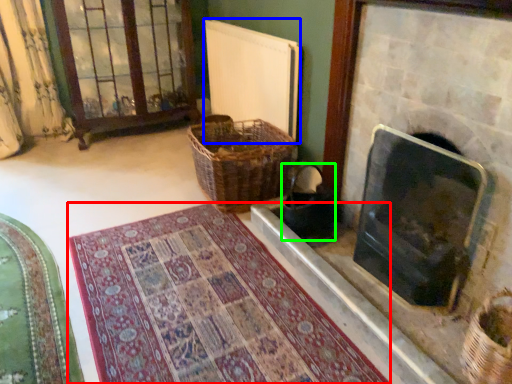
Question: Which object is positioned farthest from mat (highlighted by a red box)? Select from radiator (highlighted by a blue box) and laundry basket (highlighted by a green box).

Choices:
 (A) radiator
 (B) laundry basket

Answer: (A)